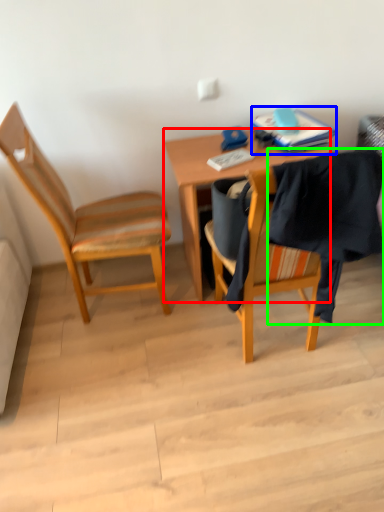
Question: Based on their relative distances, which object is farther from desk (highlighted by a red box)? Choose from book (highlighted by a blue box) and clothe (highlighted by a green box).

Choices:
 (A) book
 (B) clothe

Answer: (B)